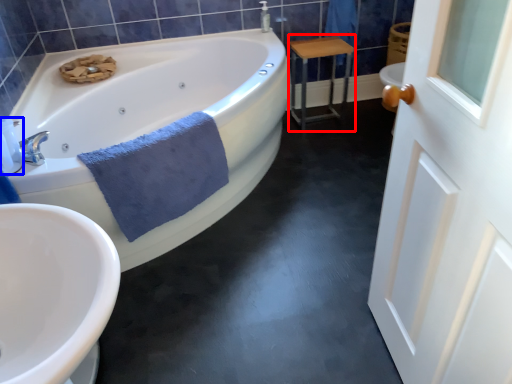
Question: Which object appears farthest to the camera in this image, table (highlighted by a red box) or toiletry (highlighted by a blue box)?

Choices:
 (A) table
 (B) toiletry

Answer: (A)